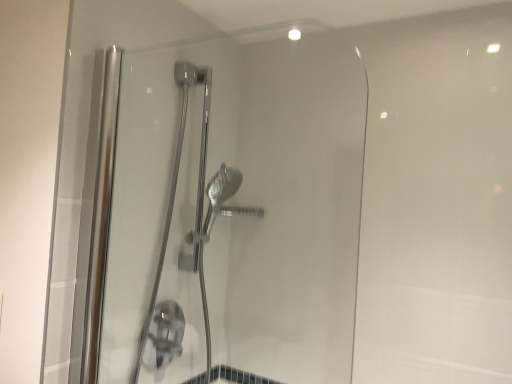
Question: From the image's perspective, relative to clear glass shower door at center, positioned as the first shower door in front-to-back order, is chrome metallic shower door at center, which is the 1th shower door in back-to-front order, above or below?

Choices:
 (A) above
 (B) below

Answer: (B)

Question: Considering the positions of point (204, 160) and point (281, 347), is point (204, 160) closer or farther from the camera than point (281, 347)?

Choices:
 (A) closer
 (B) farther

Answer: (B)

Question: Choose the correct answer: Is chrome metallic shower door at center, which is the 1th shower door in back-to-front order, inside clear glass shower door at center, the second shower door in the back-to-front sequence, or outside it?

Choices:
 (A) inside
 (B) outside

Answer: (B)

Question: From a real-world perspective, is clear glass shower door at center, the second shower door in the back-to-front sequence, positioned above or below chrome metallic shower door at center, the 2th shower door viewed from the front?

Choices:
 (A) above
 (B) below

Answer: (A)

Question: Would you say clear glass shower door at center, positioned as the first shower door in front-to-back order, is to the left or to the right of chrome metallic shower door at center, which is the 1th shower door in back-to-front order, in the picture?

Choices:
 (A) right
 (B) left

Answer: (A)

Question: Considering their positions, is clear glass shower door at center, the second shower door in the back-to-front sequence, located in front of or behind chrome metallic shower door at center, which is the 1th shower door in back-to-front order?

Choices:
 (A) front
 (B) behind

Answer: (A)

Question: Looking at the image, does clear glass shower door at center, positioned as the first shower door in front-to-back order, seem bigger or smaller compared to chrome metallic shower door at center, the 2th shower door viewed from the front?

Choices:
 (A) big
 (B) small

Answer: (B)